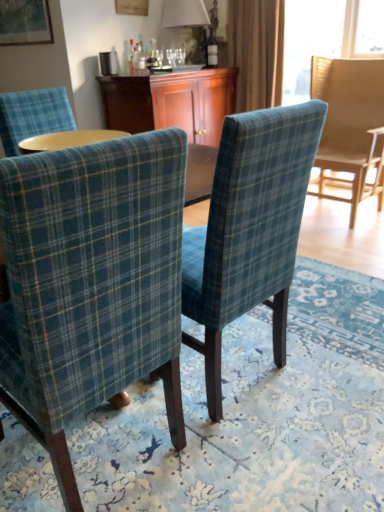
Question: Is teal plaid chair at right, the first chair when ordered from right to left, aimed at blue plaid fabric chair at center, which is counted as the second chair, starting from the front?

Choices:
 (A) yes
 (B) no

Answer: (A)

Question: Can we say teal plaid chair at right, arranged as the 3th chair when viewed from the left, lies outside blue plaid fabric chair at center, the 2th chair in the back-to-front sequence?

Choices:
 (A) yes
 (B) no

Answer: (A)

Question: Does teal plaid chair at right, arranged as the 3th chair when viewed from the left, come in front of blue plaid fabric chair at center, which is counted as the second chair, starting from the right?

Choices:
 (A) no
 (B) yes

Answer: (A)

Question: Does teal plaid chair at right, which is counted as the third chair, starting from the front, have a lesser height compared to blue plaid fabric chair at center, which is counted as the second chair, starting from the front?

Choices:
 (A) no
 (B) yes

Answer: (A)

Question: From the image's perspective, does teal plaid chair at right, the first chair when ordered from right to left, appear lower than blue plaid fabric chair at center, which is counted as the second chair, starting from the right?

Choices:
 (A) yes
 (B) no

Answer: (B)

Question: Does teal plaid chair at right, which is counted as the third chair, starting from the front, come behind blue plaid fabric chair at center, which is counted as the second chair, starting from the left?

Choices:
 (A) yes
 (B) no

Answer: (A)

Question: Can you confirm if teal plaid chair at right, the first chair when ordered from right to left, is wider than wooden cabinet at center?

Choices:
 (A) yes
 (B) no

Answer: (B)

Question: Does teal plaid chair at right, arranged as the 3th chair when viewed from the left, come in front of wooden cabinet at center?

Choices:
 (A) no
 (B) yes

Answer: (B)

Question: From a real-world perspective, is teal plaid chair at right, the first chair when ordered from right to left, positioned under wooden cabinet at center based on gravity?

Choices:
 (A) yes
 (B) no

Answer: (A)

Question: From a real-world perspective, is teal plaid chair at right, which is counted as the third chair, starting from the front, located higher than wooden cabinet at center?

Choices:
 (A) yes
 (B) no

Answer: (B)

Question: Considering the relative positions of teal plaid chair at right, arranged as the 3th chair when viewed from the left, and wooden cabinet at center in the image provided, is teal plaid chair at right, arranged as the 3th chair when viewed from the left, behind wooden cabinet at center?

Choices:
 (A) no
 (B) yes

Answer: (A)

Question: Does teal plaid chair at right, the first chair when ordered from right to left, have a lesser height compared to wooden cabinet at center?

Choices:
 (A) no
 (B) yes

Answer: (A)

Question: Considering the relative positions of plaid fabric chair at center, the first chair positioned from the front, and wooden cabinet at center in the image provided, is plaid fabric chair at center, the first chair positioned from the front, to the right of wooden cabinet at center from the viewer's perspective?

Choices:
 (A) yes
 (B) no

Answer: (B)